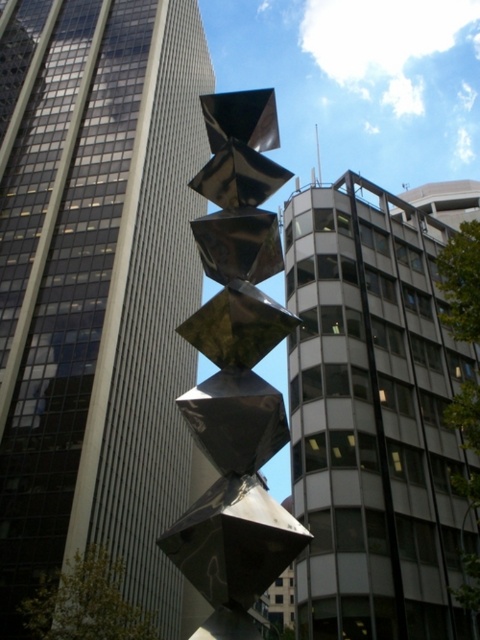
Question: Does smooth glass skyscraper at center have a lesser width compared to metallic glass building at center?

Choices:
 (A) yes
 (B) no

Answer: (B)

Question: From the image, what is the correct spatial relationship of smooth glass skyscraper at center in relation to metallic glass building at center?

Choices:
 (A) above
 (B) below

Answer: (A)

Question: Which object is the closest to the metallic reflective cubes at center?

Choices:
 (A) metallic glass building at center
 (B) smooth glass skyscraper at center

Answer: (A)

Question: Among these objects, which one is nearest to the camera?

Choices:
 (A) metallic reflective cubes at center
 (B) smooth glass skyscraper at center

Answer: (A)

Question: Is smooth glass skyscraper at center wider than metallic reflective cubes at center?

Choices:
 (A) no
 (B) yes

Answer: (B)

Question: Estimate the real-world distances between objects in this image. Which object is farther from the metallic reflective cubes at center?

Choices:
 (A) metallic glass building at center
 (B) smooth glass skyscraper at center

Answer: (B)